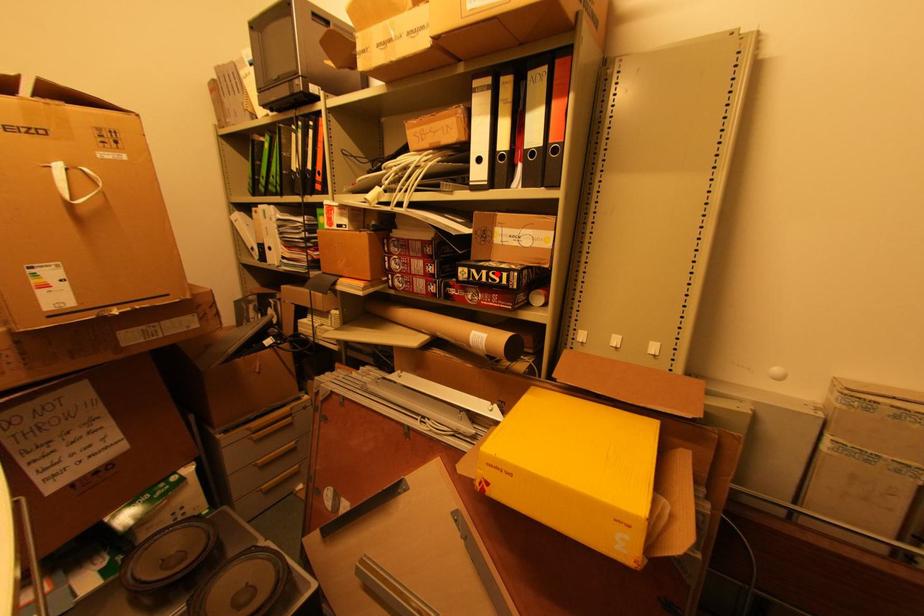
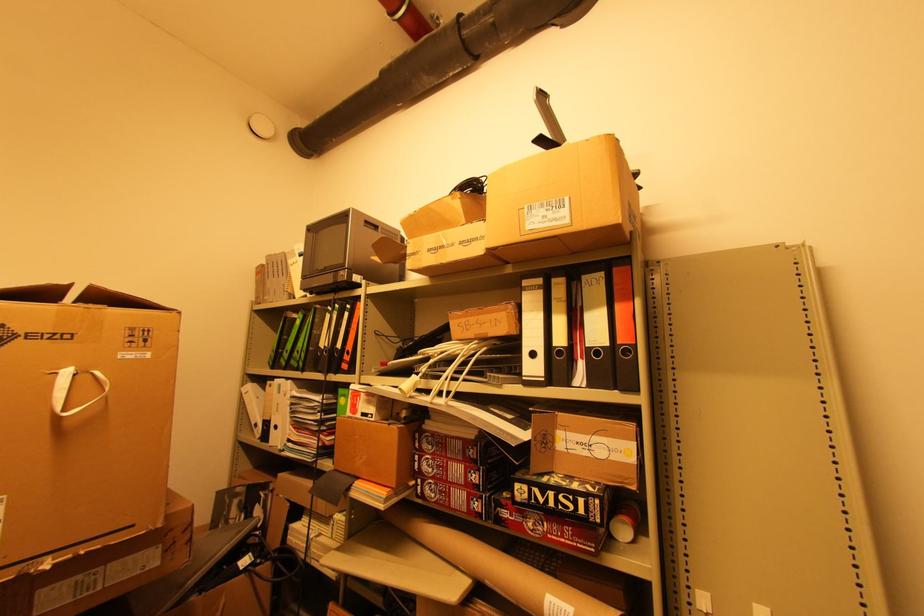
Find the pixel in the second image that matches the highlighted location in the first image.

(568, 498)